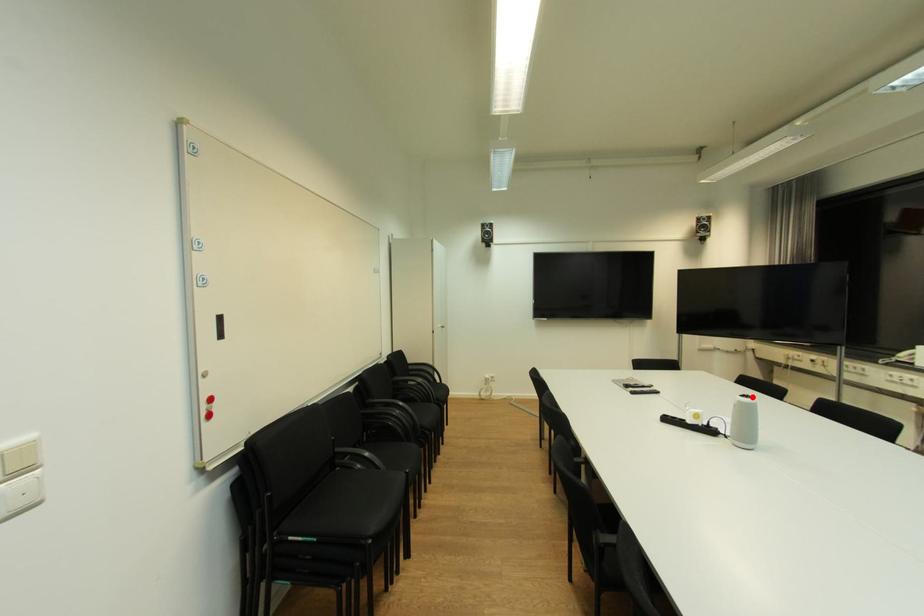
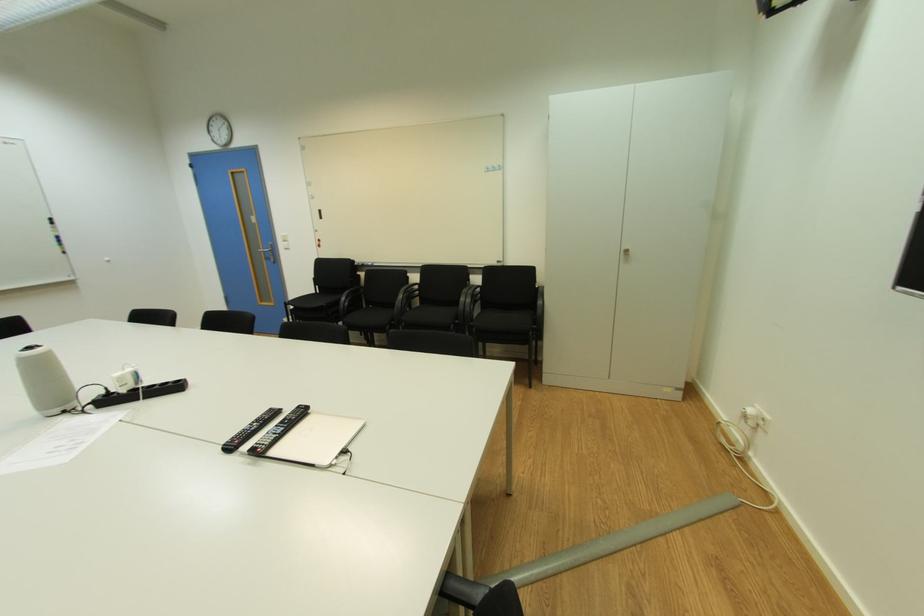
Find the pixel in the second image that matches the highlighted location in the first image.

(34, 349)